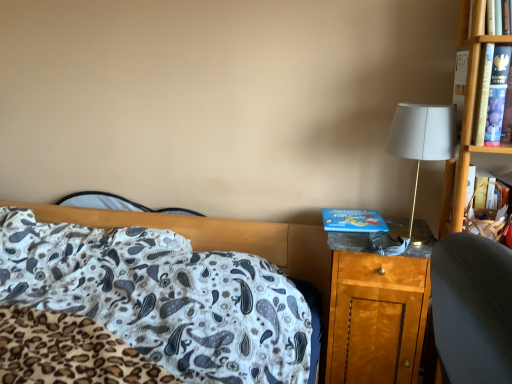
Question: Is white fabric lampshade at right touching white paisley fabric at center?

Choices:
 (A) no
 (B) yes

Answer: (A)

Question: From a real-world perspective, is white fabric lampshade at right located beneath white paisley fabric at center?

Choices:
 (A) no
 (B) yes

Answer: (A)

Question: Is white fabric lampshade at right aimed at white paisley fabric at center?

Choices:
 (A) no
 (B) yes

Answer: (A)

Question: Is white fabric lampshade at right positioned far away from white paisley fabric at center?

Choices:
 (A) yes
 (B) no

Answer: (A)

Question: From a real-world perspective, is white fabric lampshade at right located higher than white paisley fabric at center?

Choices:
 (A) yes
 (B) no

Answer: (A)

Question: From a real-world perspective, relative to white paisley fabric at center, is wooden nightstand at right vertically above or below?

Choices:
 (A) below
 (B) above

Answer: (A)

Question: In terms of height, does wooden nightstand at right look taller or shorter compared to white paisley fabric at center?

Choices:
 (A) short
 (B) tall

Answer: (B)

Question: From the image's perspective, is wooden nightstand at right above or below white paisley fabric at center?

Choices:
 (A) below
 (B) above

Answer: (A)

Question: In the image, is wooden nightstand at right positioned in front of or behind white paisley fabric at center?

Choices:
 (A) front
 (B) behind

Answer: (B)

Question: From the image's perspective, relative to blue cardboard book at right, is white paisley fabric at center above or below?

Choices:
 (A) below
 (B) above

Answer: (A)

Question: Looking at their shapes, would you say white paisley fabric at center is wider or thinner than blue cardboard book at right?

Choices:
 (A) wide
 (B) thin

Answer: (A)

Question: Looking at the image, does white paisley fabric at center seem bigger or smaller compared to blue cardboard book at right?

Choices:
 (A) small
 (B) big

Answer: (B)

Question: In the image, is white paisley fabric at center positioned in front of or behind blue cardboard book at right?

Choices:
 (A) front
 (B) behind

Answer: (A)

Question: Is point (5, 208) positioned closer to the camera than point (362, 344)?

Choices:
 (A) closer
 (B) farther

Answer: (B)

Question: In terms of width, does white paisley fabric at center look wider or thinner when compared to wooden nightstand at right?

Choices:
 (A) wide
 (B) thin

Answer: (A)